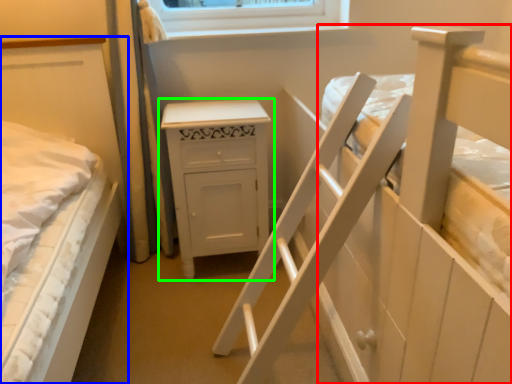
Question: Based on their relative distances, which object is farther from bed (highlighted by a red box)? Choose from bed (highlighted by a blue box) and chest of drawers (highlighted by a green box).

Choices:
 (A) bed
 (B) chest of drawers

Answer: (A)